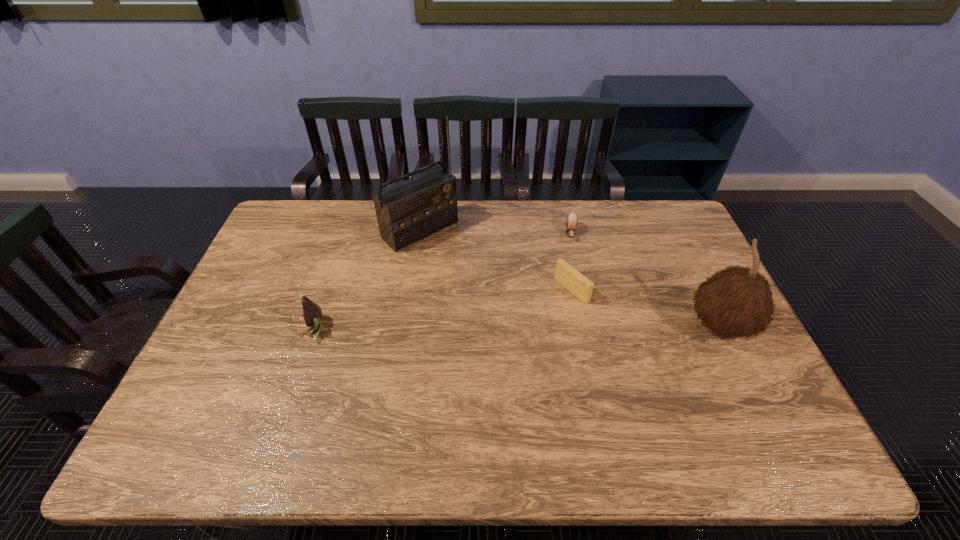
Locate an element on the screen. The height and width of the screenshot is (540, 960). vacant space on the desktop that is between the leftmost object and the rightmost object and is positioned on the front-facing side of the shortest object is located at coordinates (570, 327).

Find the location of a particular element. The width and height of the screenshot is (960, 540). free space on the desktop that is between the leftmost object and the coconut and is positioned on the front panel of the second object from left to right is located at coordinates (533, 328).

Find the location of a particular element. vacant space on the desktop that is between the avocado and the coconut and is positioned at the front of the videotape with spools is located at coordinates (508, 328).